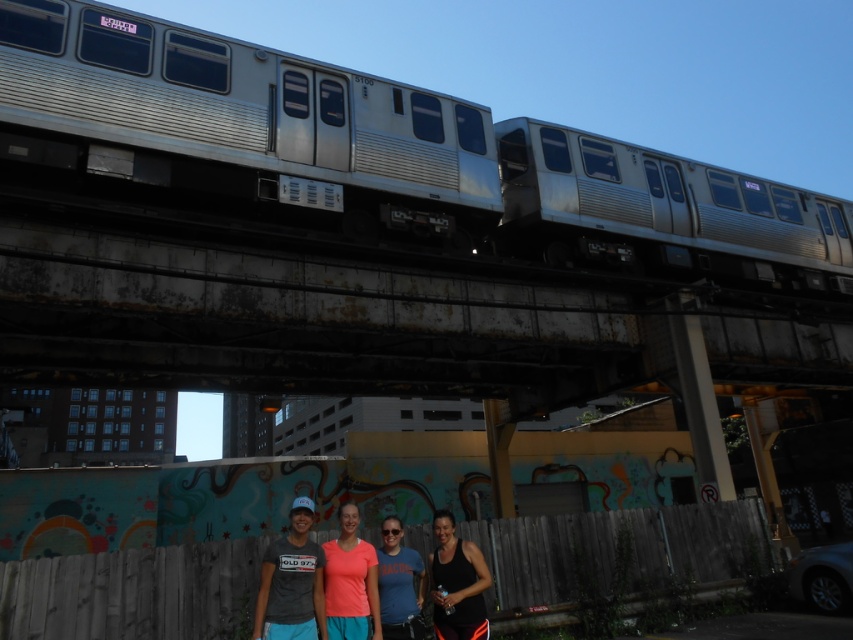
In the scene shown: You are standing at the point closest to the wooden fence. Which point, point (343,611) or point (401,637), is closer to you?

Point (343,611) is closer to you because it is in front of point (401,637).